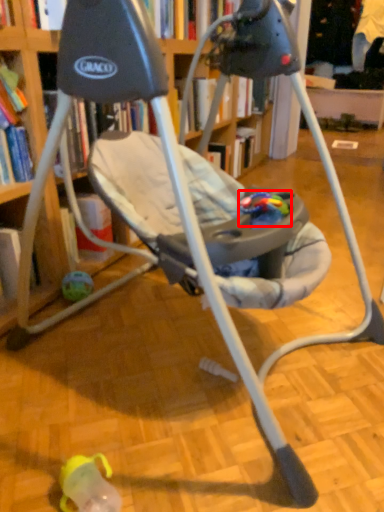
Question: Observing the image, what is the correct spatial positioning of toy (annotated by the red box) in reference to toy?

Choices:
 (A) right
 (B) left

Answer: (A)